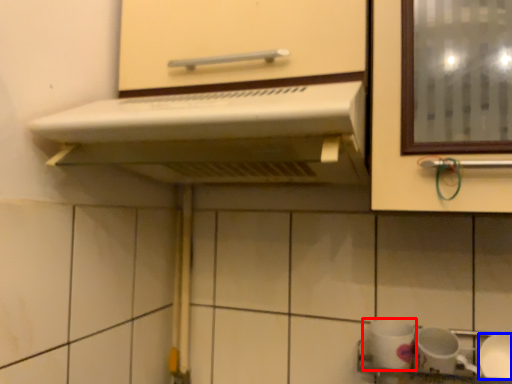
Question: Which point is further to the camera, tableware (highlighted by a red box) or tableware (highlighted by a blue box)?

Choices:
 (A) tableware
 (B) tableware

Answer: (A)